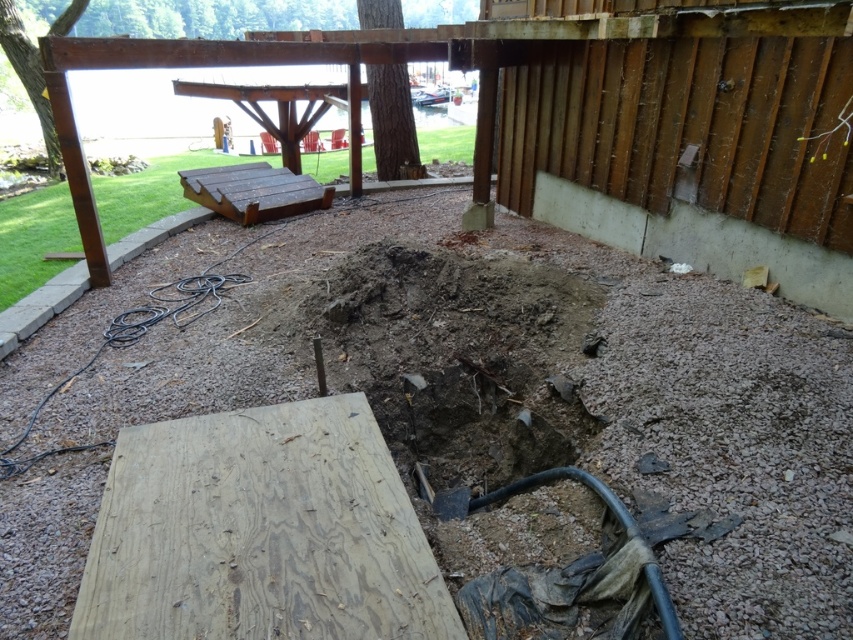
You are a construction worker standing at the point marked by the coordinate point (700, 243). Looking around, you see the gray concrete foundation at right. Which direction should you walk to reach the gray concrete foundation at right?

Since the point (700, 243) marks the gray concrete foundation at right, you are already at the gray concrete foundation at right.

You are a construction worker who needs to place a new support beam. The beam must be positioned exactly at the center of the gray concrete foundation at right. Using the coordinate system provided, what are the coordinates where you should place the beam?

The gray concrete foundation at right is located at point (700,243), so the support beam should be placed at the center coordinates of this point, which would be approximately (700,243).

Consider the image. You are planning to move the brown wooden picnic table at upper left and the black rubber hose at lower left to a storage area. The storage area has a width limit of 1.2 meters. Based on their widths, can both items fit side by side within the storage area?

The brown wooden picnic table at upper left is wider than the black rubber hose at lower left. Since the storage area has a width limit of 1.2 meters, we need to know the combined width of both items. However, without specific measurements, we can only state their relative sizes. If the picnic table is wider than the hose, their combined width may exceed the limit. Further information is needed to determine if they can fit together.